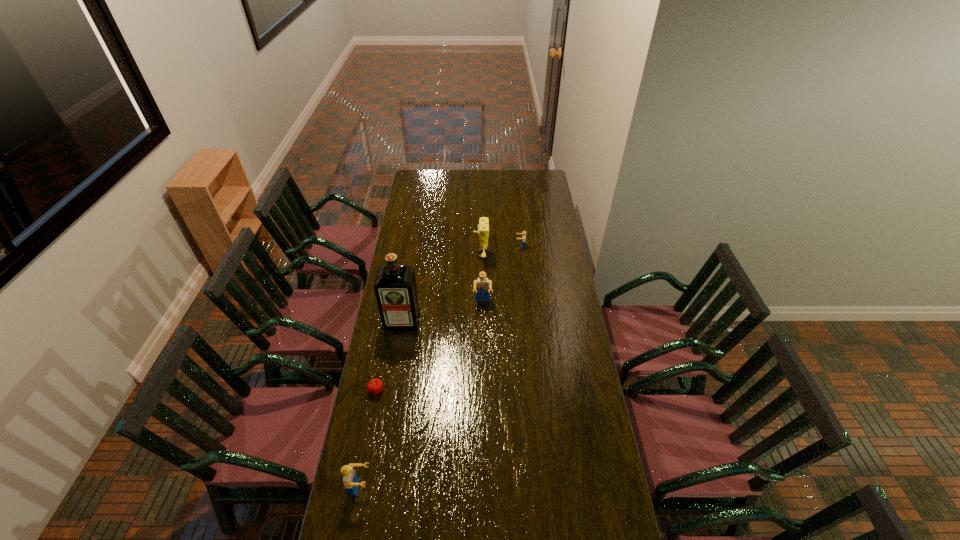
Locate which Lego ranks in proximity to the second Lego from right to left. Please provide its 2D coordinates. Your answer should be formatted as a tuple, i.e. [(x, y)], where the tuple contains the x and y coordinates of a point satisfying the conditions above.

[(523, 233)]

Identify the location of free location that satisfies the following two spatial constraints: 1. on the face of the fourth nearest object; 2. on the face of the second tallest Lego. (484, 487).